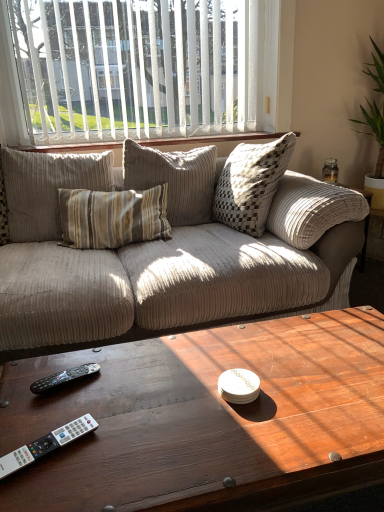
Find the location of a particular element. vacant space to the right of white plastic remote control at lower left, which ranks as the 2th remote control in back-to-front order is located at coordinates (122, 452).